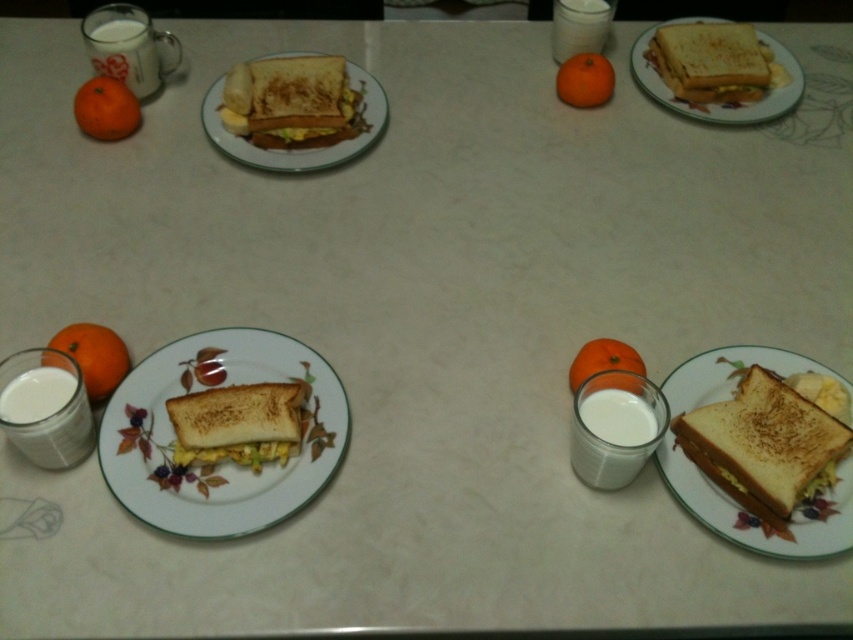
You are arranging breakfast items on a table. You have a matte white plate at center and an orange matte at left. According to the image, which item is positioned to the right of the other?

The matte white plate at center is to the right of the orange matte at left.

You are a chef arranging items on a table. You have a matte white plate at center and an orange matte at left. Which item is taller?

The matte white plate at center is taller than the orange matte at left.

You are sitting at the breakfast table and want to grab an orange. Which orange, the orange matte at left or the orange matte at upper center, is easier to reach without moving your chair?

The orange matte at left is closer to the viewer, so it is easier to reach without moving your chair.